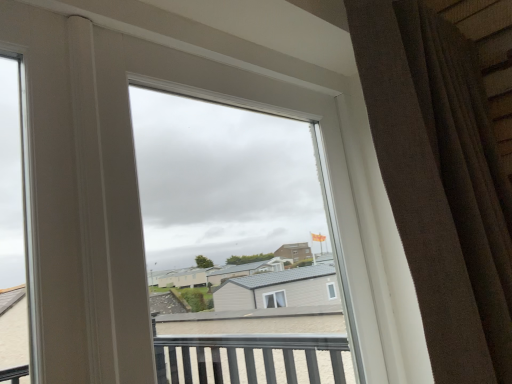
Where is `brown textured curtain at right`? The width and height of the screenshot is (512, 384). brown textured curtain at right is located at coordinates (440, 183).

Describe the element at coordinates (440, 183) in the screenshot. I see `brown textured curtain at right` at that location.

Image resolution: width=512 pixels, height=384 pixels. What are the coordinates of `brown textured curtain at right` in the screenshot? It's located at pyautogui.click(x=440, y=183).